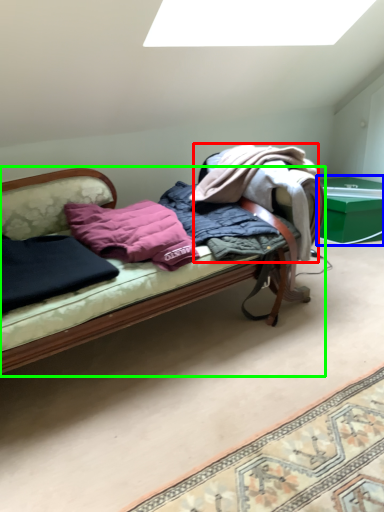
Question: Based on their relative distances, which object is nearer to clothing (highlighted by a red box)? Choose from table (highlighted by a blue box) and studio couch (highlighted by a green box).

Choices:
 (A) table
 (B) studio couch

Answer: (B)